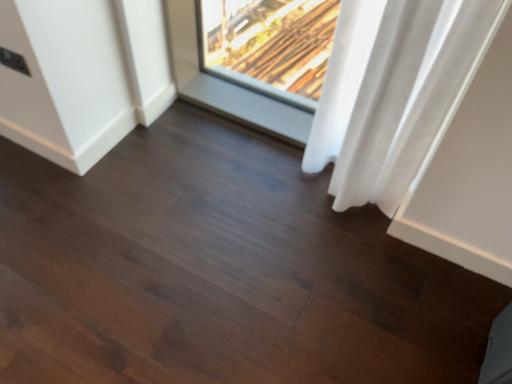
Locate an element on the screen. The width and height of the screenshot is (512, 384). free space in front of white sheer curtain at right is located at coordinates (353, 257).